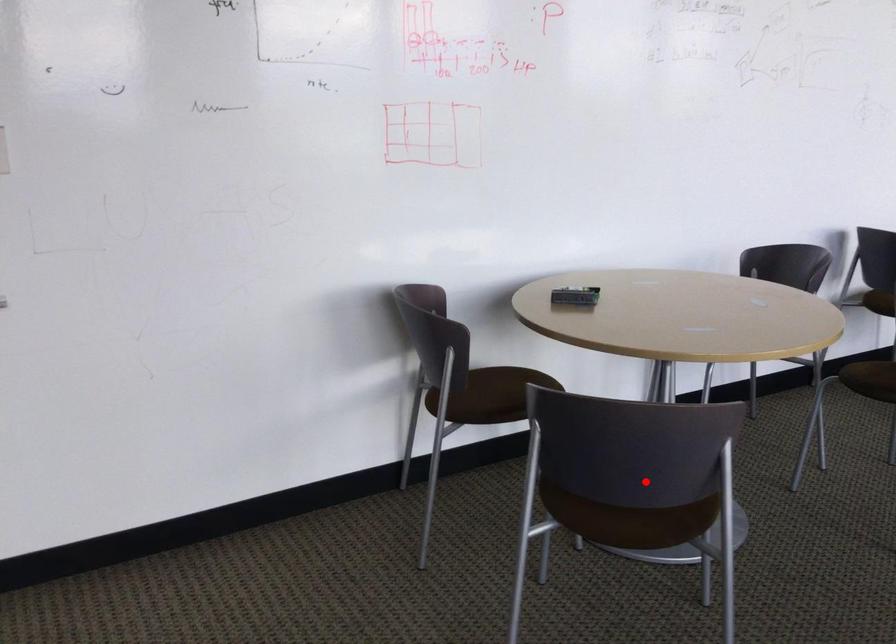
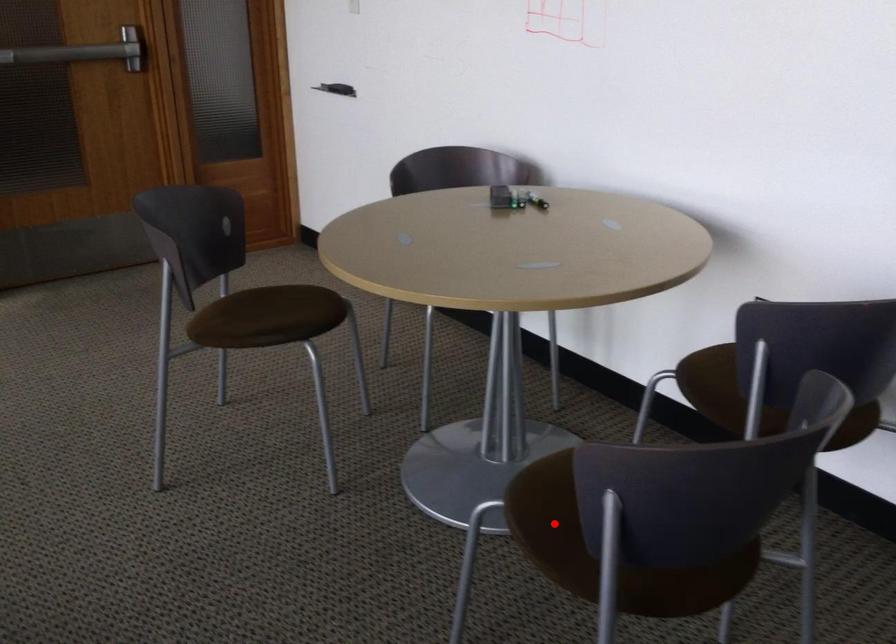
I am providing you with two images of the same scene from different viewpoints. A red point is marked on the first image and another point is marked on the second image. Do the highlighted points in image1 and image2 indicate the same real-world spot?

No